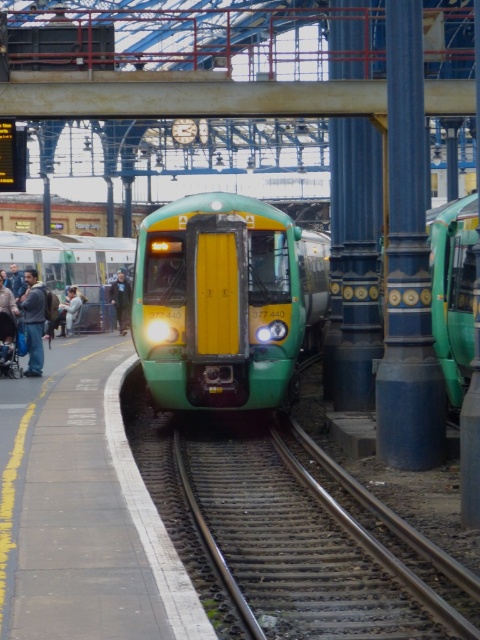
You are a passenger waiting at the train station. You notice the green matte train at right and the light gray fabric jacket at left. Which object takes up more space horizontally in the image?

The green matte train at right takes up more horizontal space because its width is larger than the light gray fabric jacket at left.